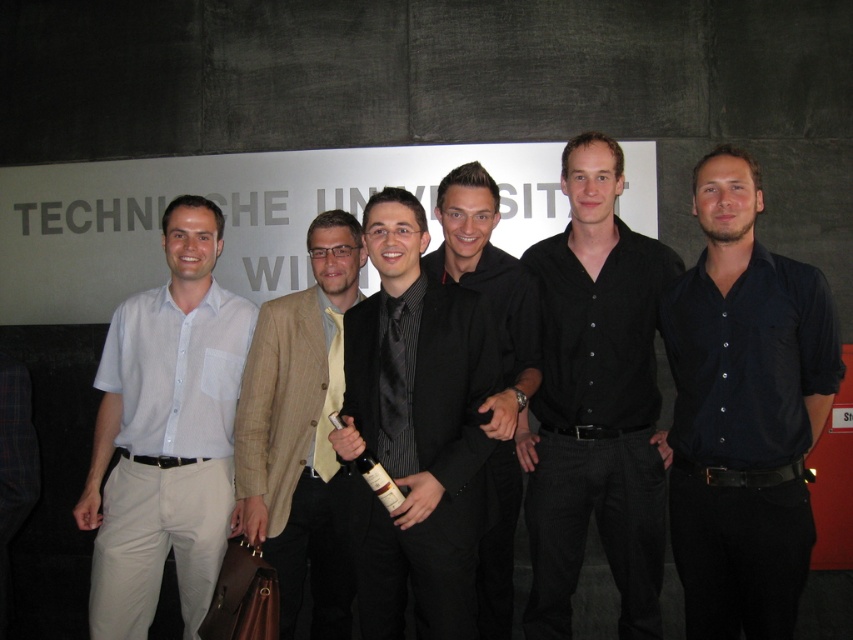
Who is more forward, (770,561) or (477,268)?

Point (770,561) is in front.

Which of these two, black matte shirt at right or black satin robe at center, stands taller?

black matte shirt at right is taller.

Is point (714, 234) positioned before point (497, 468)?

Yes, point (714, 234) is closer to viewer.

This screenshot has height=640, width=853. I want to click on black matte shirt at right, so click(743, 412).

Is the position of black matte shirt at center less distant than that of black satin robe at center?

No, it is not.

Does black matte shirt at center appear on the left side of black satin robe at center?

Incorrect, black matte shirt at center is not on the left side of black satin robe at center.

Image resolution: width=853 pixels, height=640 pixels. Describe the element at coordinates (595, 403) in the screenshot. I see `black matte shirt at center` at that location.

This screenshot has width=853, height=640. Find the location of `black matte shirt at center`. black matte shirt at center is located at coordinates (595, 403).

Which is more to the right, black satin suit at center or tan textured blazer at center?

From the viewer's perspective, black satin suit at center appears more on the right side.

Is point (373, 241) positioned after point (289, 371)?

No.

Locate an element on the screen. This screenshot has width=853, height=640. black satin suit at center is located at coordinates pos(416,429).